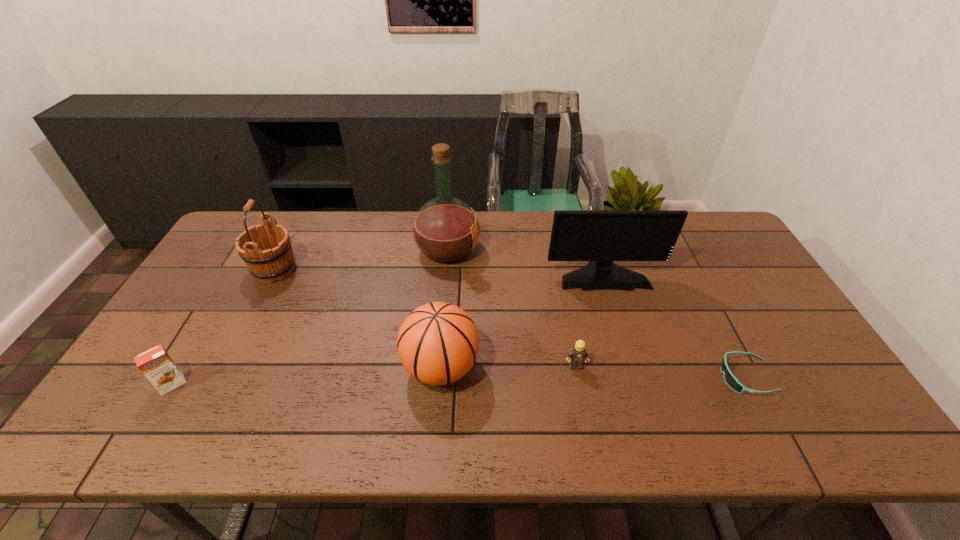
Where is `the tallest object`? the tallest object is located at coordinates (445, 229).

Image resolution: width=960 pixels, height=540 pixels. Find the location of `wine bucket`. wine bucket is located at coordinates (266, 249).

In order to click on monitor in this screenshot , I will do `click(600, 236)`.

Locate an element on the screen. This screenshot has width=960, height=540. the fourth tallest object is located at coordinates (438, 343).

Locate an element on the screen. orange juice is located at coordinates (156, 364).

Find the location of a particular element. Image resolution: width=960 pixels, height=540 pixels. the second shortest object is located at coordinates (577, 355).

Image resolution: width=960 pixels, height=540 pixels. I want to click on the rightmost object, so click(x=730, y=379).

Find the location of a particular element. The image size is (960, 540). the shortest object is located at coordinates [730, 379].

At what (x,y) coordinates should I click in order to perform the action: click on vacant space located 0.330m on the front label of the tallest object. Please return your answer as a coordinate pair (x, y). The image size is (960, 540). Looking at the image, I should click on (580, 250).

You are a GUI agent. You are given a task and a screenshot of the screen. Output one action in this format:
    pyautogui.click(x=<x>, y=<y>)
    Task: Click on the free location located 0.130m on the right of the wine bucket
    
    Given the screenshot: What is the action you would take?
    pyautogui.click(x=340, y=269)